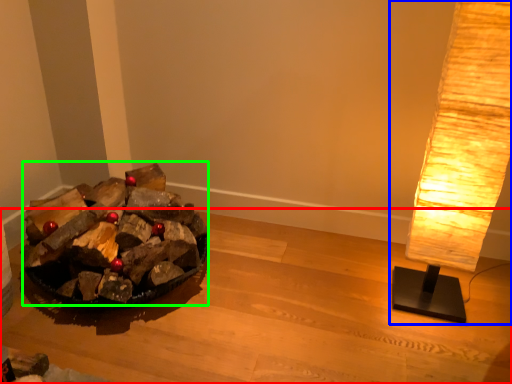
Question: Considering the real-world distances, which object is farthest from furniture (highlighted by a red box)? lamp (highlighted by a blue box) or debris (highlighted by a green box)?

Choices:
 (A) lamp
 (B) debris

Answer: (A)